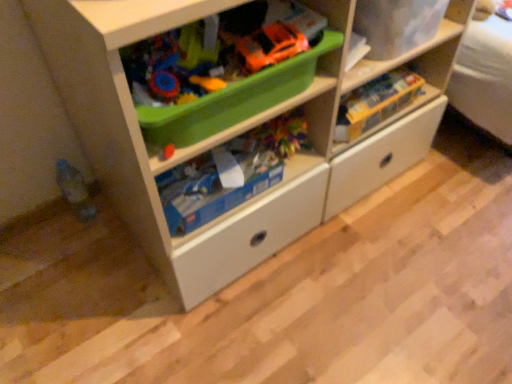
Find the location of a particular element. vacant point to the right of white matte chest of drawers at center is located at coordinates (438, 216).